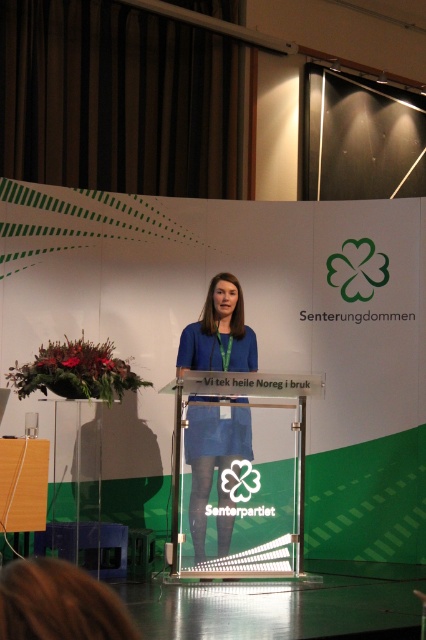
Question: Among these objects, which one is farthest from the camera?

Choices:
 (A) blue fabric dress at center
 (B) transparent glass podium at center

Answer: (A)

Question: Considering the relative positions of transparent glass podium at center and blue fabric dress at center in the image provided, where is transparent glass podium at center located with respect to blue fabric dress at center?

Choices:
 (A) above
 (B) below

Answer: (A)

Question: Which point is farther to the camera?

Choices:
 (A) blue fabric dress at center
 (B) transparent glass podium at center

Answer: (A)

Question: Is transparent glass podium at center positioned at the back of blue fabric dress at center?

Choices:
 (A) no
 (B) yes

Answer: (A)

Question: Does transparent glass podium at center come in front of blue fabric dress at center?

Choices:
 (A) yes
 (B) no

Answer: (A)